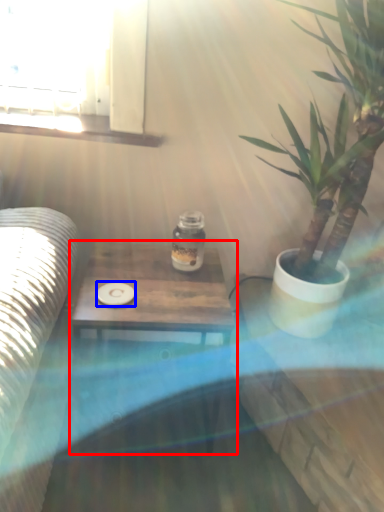
Question: Among these objects, which one is nearest to the camera, table (highlighted by a red box) or coaster (highlighted by a blue box)?

Choices:
 (A) table
 (B) coaster

Answer: (A)